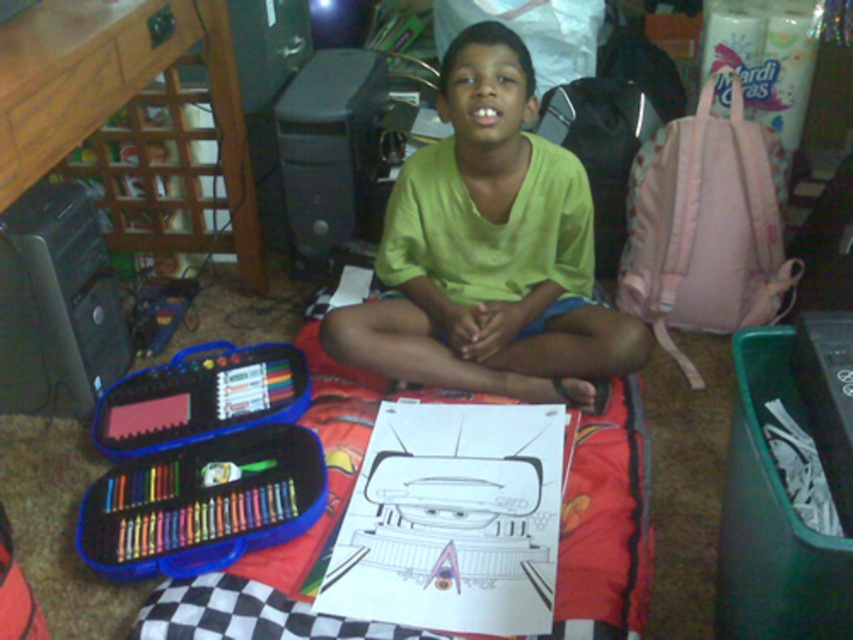
Question: Which object is farther from the camera taking this photo?

Choices:
 (A) black checkered blanket at center
 (B) green matte shirt at center

Answer: (B)

Question: Does green matte shirt at center have a lesser width compared to black checkered blanket at center?

Choices:
 (A) no
 (B) yes

Answer: (B)

Question: Observing the image, what is the correct spatial positioning of green matte shirt at center in reference to black checkered blanket at center?

Choices:
 (A) below
 (B) above

Answer: (B)

Question: Among these points, which one is farthest from the camera?

Choices:
 (A) (581, 268)
 (B) (598, 634)

Answer: (A)

Question: Considering the relative positions of green matte shirt at center and black checkered blanket at center in the image provided, where is green matte shirt at center located with respect to black checkered blanket at center?

Choices:
 (A) right
 (B) left

Answer: (A)

Question: Which of the following is the closest to the observer?

Choices:
 (A) black checkered blanket at center
 (B) green matte shirt at center

Answer: (A)